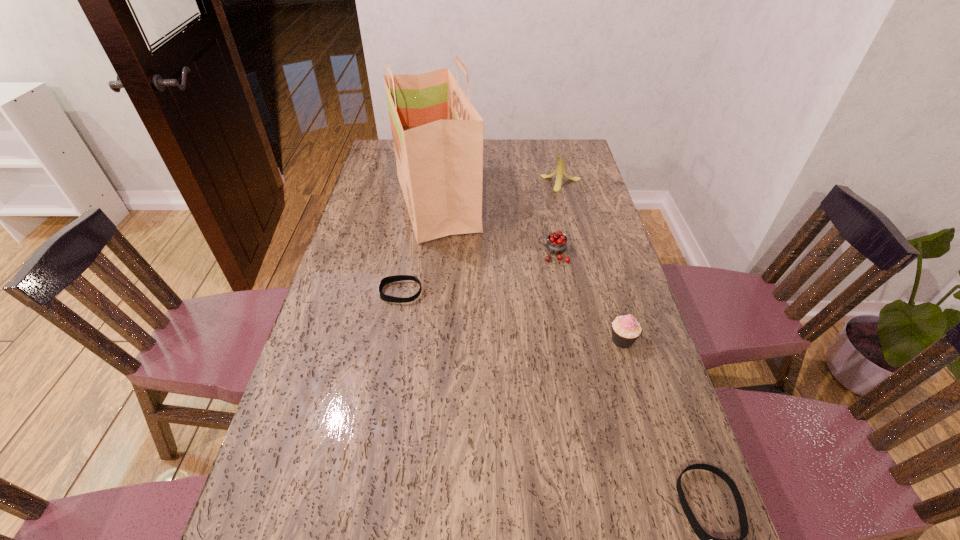
The height and width of the screenshot is (540, 960). In the image, there is a desktop. Find the location of `vacant space at the far edge`. vacant space at the far edge is located at coordinates (541, 143).

Find the location of a particular element. The image size is (960, 540). vacant space at the near edge of the desktop is located at coordinates (515, 536).

Find the location of `free space at the left edge`. free space at the left edge is located at coordinates (341, 393).

At what (x,y) coordinates should I click in order to perform the action: click on vacant area at the right edge. Please return your answer as a coordinate pair (x, y). This screenshot has height=540, width=960. Looking at the image, I should click on (588, 221).

Locate an element on the screen. The image size is (960, 540). free space between the fourth farthest object and the banana is located at coordinates (481, 238).

I want to click on free space between the cherry and the second tallest object, so point(558,218).

The width and height of the screenshot is (960, 540). What are the coordinates of `vacant area that lies between the third nearest object and the fifth shortest object` in the screenshot? It's located at (481, 238).

The image size is (960, 540). Find the location of `vacant space that is in between the tallest object and the cherry`. vacant space that is in between the tallest object and the cherry is located at coordinates (495, 228).

The width and height of the screenshot is (960, 540). I want to click on free point between the grocery bag and the fifth shortest object, so click(x=499, y=193).

Locate an element on the screen. This screenshot has width=960, height=540. free space between the fifth shortest object and the grocery bag is located at coordinates (499, 193).